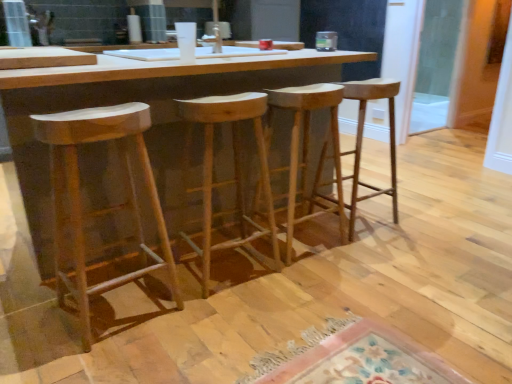
This screenshot has height=384, width=512. I want to click on free space to the right of natural wood stool at center, the 3th stool positioned from the left, so click(364, 254).